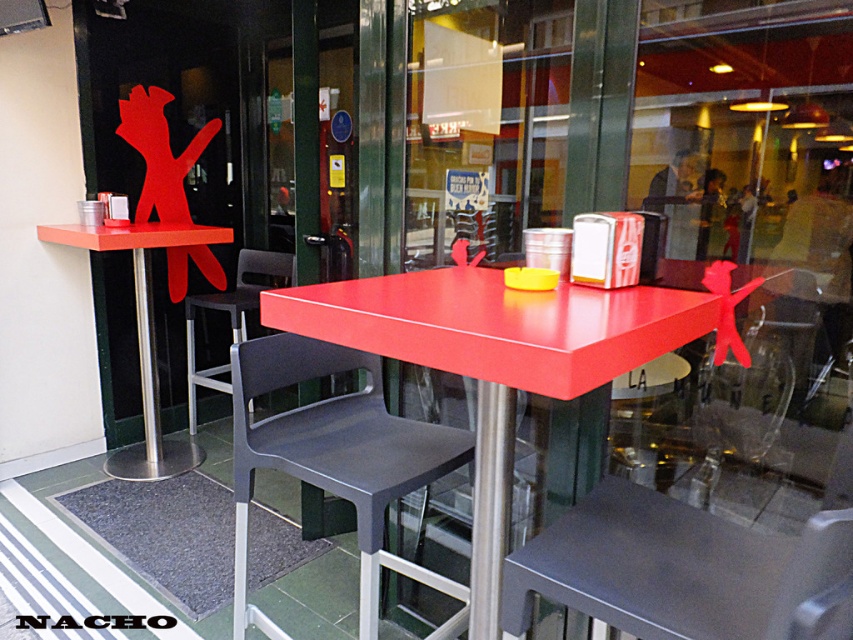
Does metallic gray chair at lower center have a greater width compared to matte red table at left?

In fact, metallic gray chair at lower center might be narrower than matte red table at left.

Does metallic gray chair at lower center have a lesser width compared to matte red table at left?

Indeed, metallic gray chair at lower center has a lesser width compared to matte red table at left.

Identify the location of metallic gray chair at lower center. This screenshot has width=853, height=640. (670, 566).

Does point (784, 564) lie behind point (244, 547)?

No.

Is metallic gray chair at lower center closer to camera compared to matte black chair at center?

Yes, metallic gray chair at lower center is in front of matte black chair at center.

Is point (730, 566) farther from camera compared to point (283, 333)?

No, (730, 566) is closer to viewer.

Locate an element on the screen. metallic gray chair at lower center is located at coordinates (670, 566).

Who is lower down, matte red table at center or matte red table at left?

matte red table at center

Does point (413, 294) lie behind point (155, 429)?

No, it is in front of (155, 429).

I want to click on matte red table at center, so click(496, 360).

Identify the location of matte red table at center. This screenshot has height=640, width=853. pos(496,360).